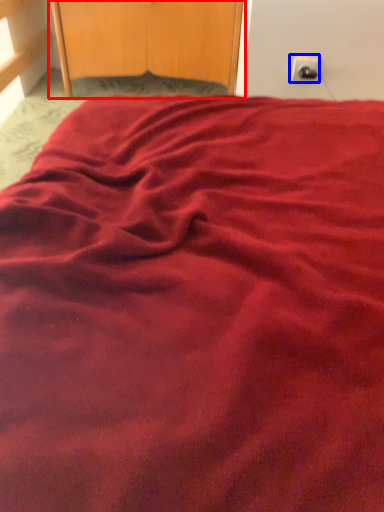
Question: Which of the following is the farthest to the observer, dresser (highlighted by a red box) or electric outlet (highlighted by a blue box)?

Choices:
 (A) dresser
 (B) electric outlet

Answer: (A)